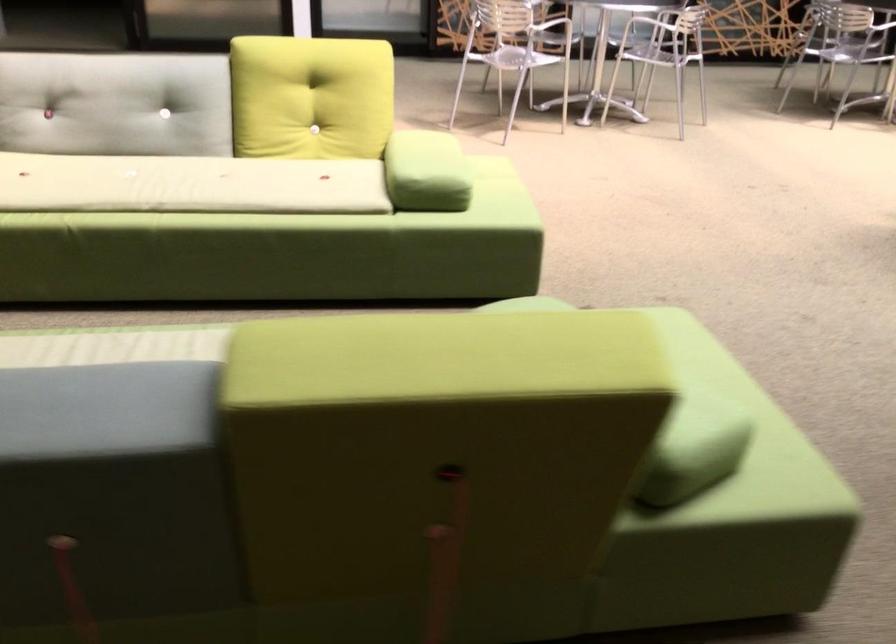
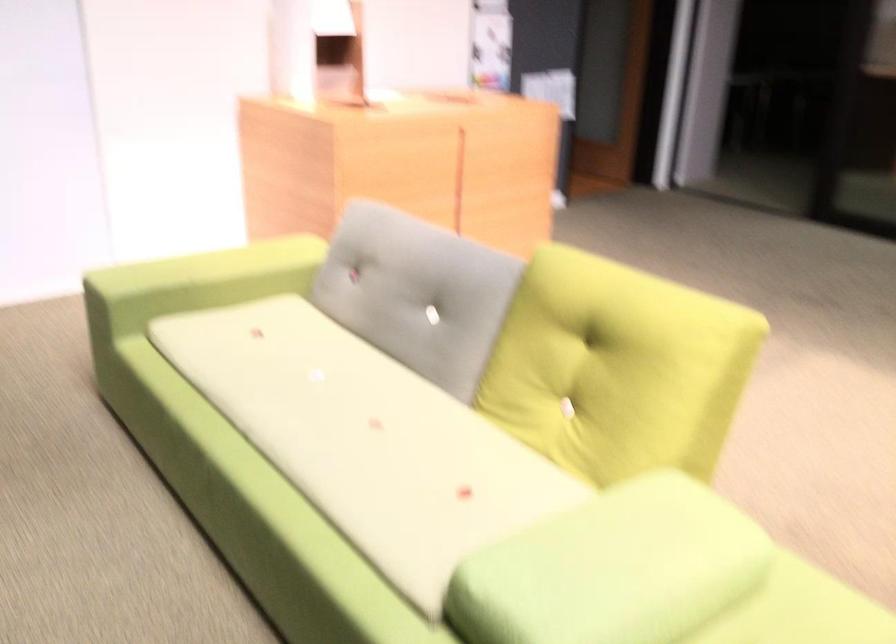
Locate, in the second image, the point that corresponds to point 237,176 in the first image.

(366, 439)